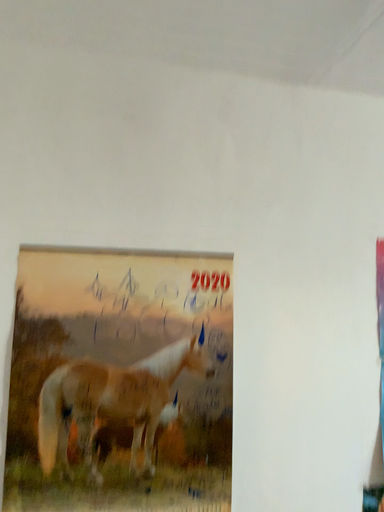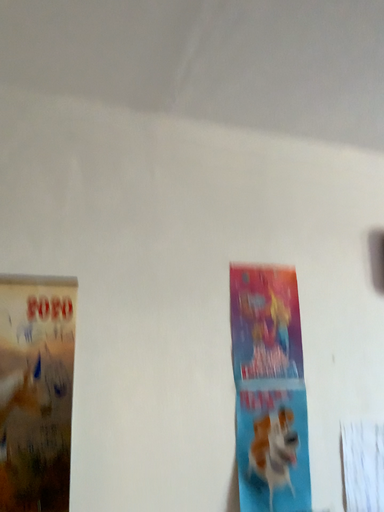
Question: Which way did the camera rotate in the video?

Choices:
 (A) rotated right
 (B) rotated left

Answer: (A)